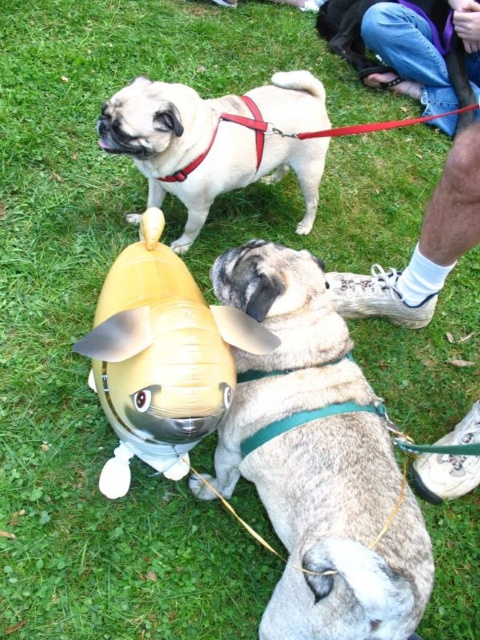
Question: Considering the real-world distances, which object is closest to the fuzzy beige dog at lower center?

Choices:
 (A) white socks at lower right
 (B) smooth black dog at upper center

Answer: (A)

Question: In this image, where is fuzzy beige dog at lower center located relative to smooth black dog at upper center?

Choices:
 (A) below
 (B) above

Answer: (A)

Question: Does fuzzy beige dog at lower center have a larger size compared to matte beige dog at upper center?

Choices:
 (A) no
 (B) yes

Answer: (A)

Question: Considering the real-world distances, which object is closest to the white socks at lower right?

Choices:
 (A) fuzzy beige dog at lower center
 (B) matte beige dog at upper center
 (C) smooth black dog at upper center

Answer: (C)

Question: Does white socks at lower right appear over smooth black dog at upper center?

Choices:
 (A) no
 (B) yes

Answer: (A)

Question: Which object is farther from the camera taking this photo?

Choices:
 (A) smooth black dog at upper center
 (B) fuzzy beige dog at lower center
 (C) white socks at lower right
 (D) matte beige dog at upper center

Answer: (A)